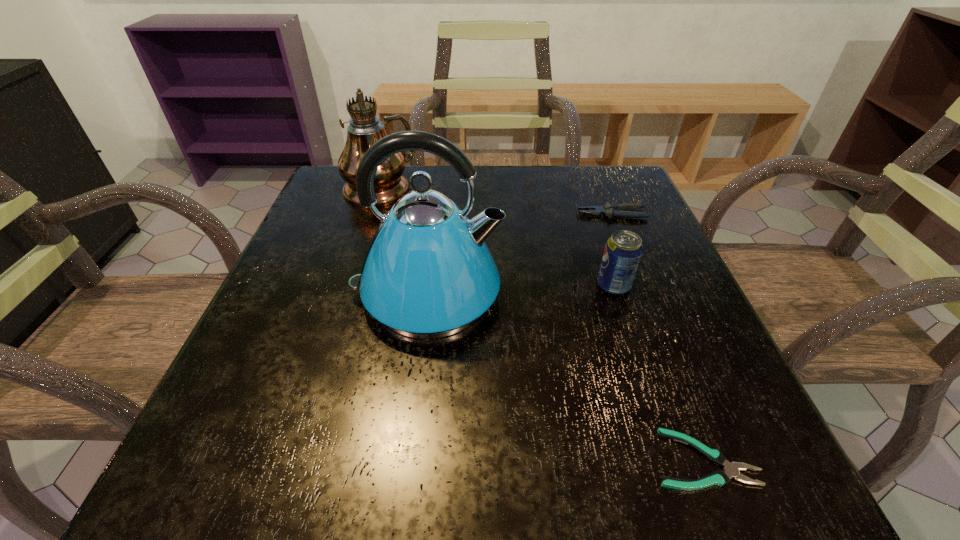
This screenshot has height=540, width=960. Identify the location of vacant area situated at the gripping part of the second shortest object. (428, 214).

Where is `vacant region located at the gripping part of the second shortest object`? vacant region located at the gripping part of the second shortest object is located at coordinates tap(483, 214).

Where is `blank space located at the gripping part of the second shortest object`? The height and width of the screenshot is (540, 960). blank space located at the gripping part of the second shortest object is located at coordinates (528, 214).

Locate an element on the screen. Image resolution: width=960 pixels, height=540 pixels. vacant space located on the left of the nearest object is located at coordinates (590, 459).

The image size is (960, 540). In order to click on oil lamp located in the far edge section of the desktop in this screenshot , I will do `click(356, 81)`.

Where is `pliers at the far edge`? This screenshot has width=960, height=540. pliers at the far edge is located at coordinates (610, 210).

You are a GUI agent. You are given a task and a screenshot of the screen. Output one action in this format:
    pyautogui.click(x=<x>, y=<y>)
    Task: Click on the object that is at the near edge
    The width and height of the screenshot is (960, 540).
    Given the screenshot: What is the action you would take?
    pyautogui.click(x=731, y=470)

Find the location of a particular element. The height and width of the screenshot is (540, 960). oil lamp situated at the left edge is located at coordinates (356, 81).

Image resolution: width=960 pixels, height=540 pixels. Find the location of `kettle at the left edge`. kettle at the left edge is located at coordinates (428, 273).

What are the coordinates of `soda at the right edge` in the screenshot? It's located at (623, 250).